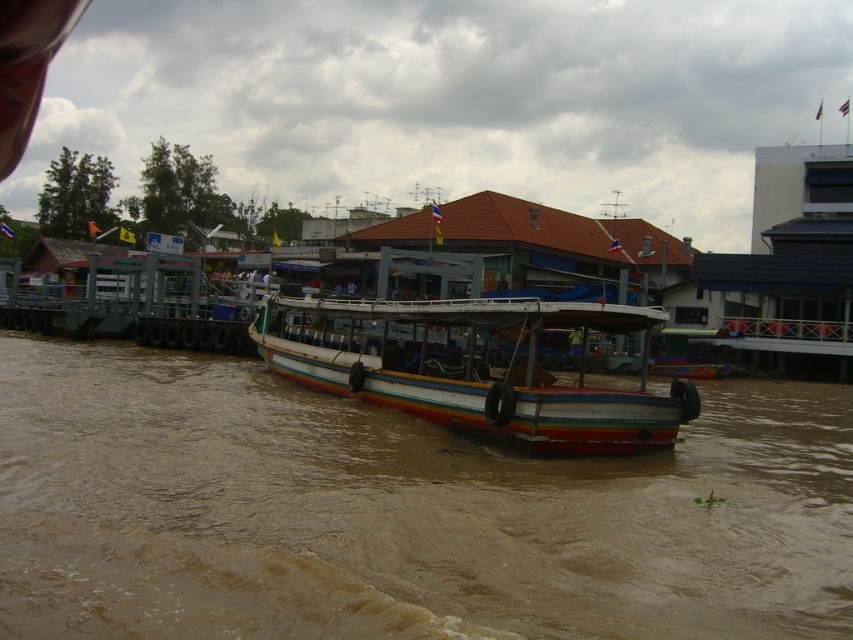
Question: Among these points, which one is nearest to the camera?

Choices:
 (A) (549, 316)
 (B) (22, 452)

Answer: (B)

Question: Is brown muddy water at center below rainbow painted wood boat at center?

Choices:
 (A) yes
 (B) no

Answer: (A)

Question: Can you confirm if brown muddy water at center is smaller than rainbow painted wood boat at center?

Choices:
 (A) yes
 (B) no

Answer: (A)

Question: Which point is closer to the camera?

Choices:
 (A) (41, 634)
 (B) (538, 307)

Answer: (A)

Question: Does brown muddy water at center appear on the right side of rainbow painted wood boat at center?

Choices:
 (A) no
 (B) yes

Answer: (A)